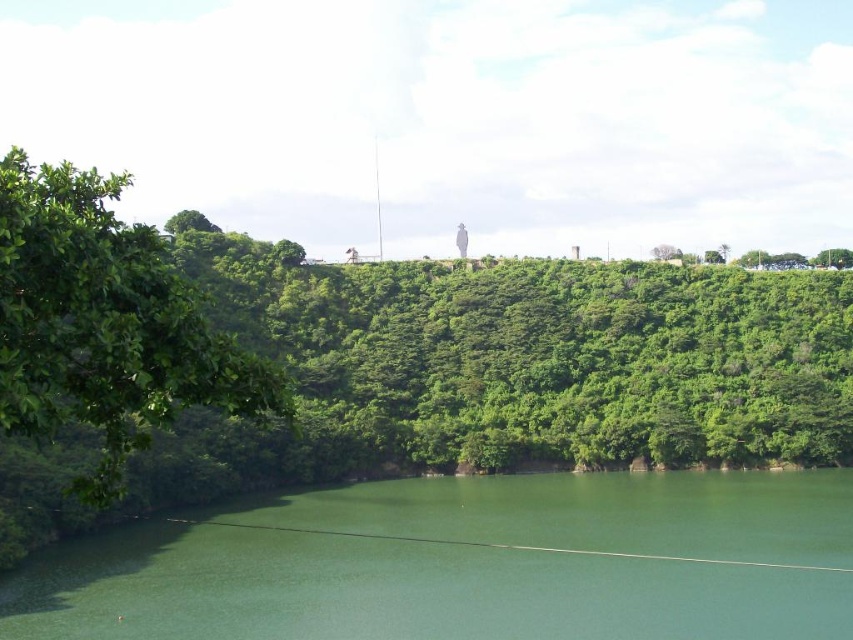
Question: Does green smooth water at center lie in front of green leafy tree at left?

Choices:
 (A) no
 (B) yes

Answer: (A)

Question: Does green smooth water at center have a larger size compared to green leafy tree at left?

Choices:
 (A) yes
 (B) no

Answer: (B)

Question: Which of the following is the farthest from the observer?

Choices:
 (A) click(x=383, y=577)
 (B) click(x=109, y=472)

Answer: (A)

Question: Which point appears farthest from the camera in this image?

Choices:
 (A) (108, 403)
 (B) (653, 493)

Answer: (B)

Question: Does green smooth water at center appear under green leafy tree at left?

Choices:
 (A) yes
 (B) no

Answer: (A)